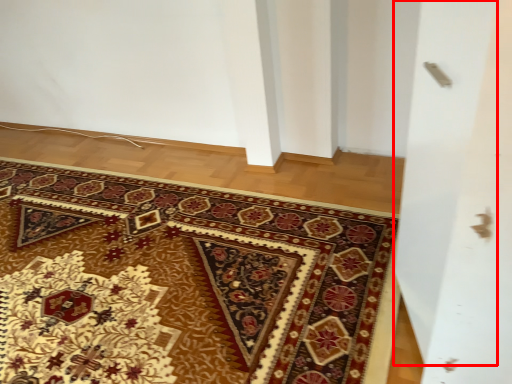
Question: Observing the image, what is the correct spatial positioning of screen door (annotated by the red box) in reference to mat?

Choices:
 (A) right
 (B) left

Answer: (A)